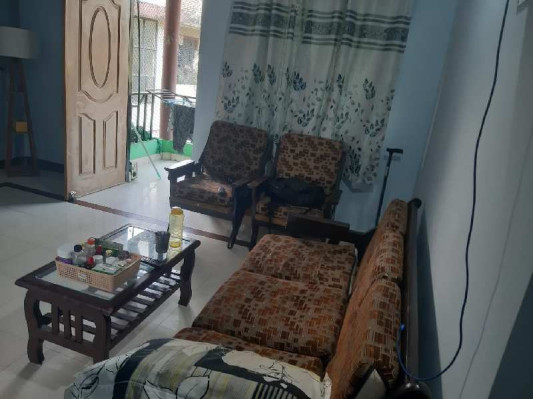
Where is `sofa`? This screenshot has height=399, width=533. sofa is located at coordinates (297, 318).